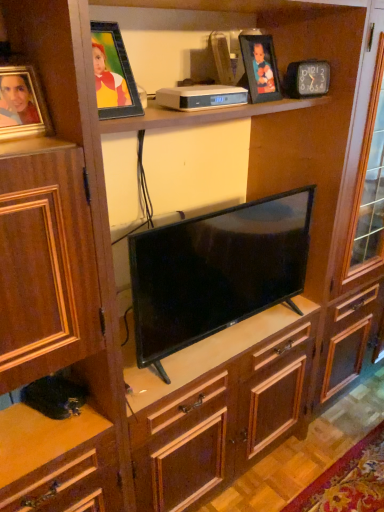
You are a GUI agent. You are given a task and a screenshot of the screen. Output one action in this format:
    pyautogui.click(x=<x>, y=<y>)
    Task: Click on the matte gold picture frame at left, acting as the 2th picture frame starting from the top
    The image size is (384, 512).
    Given the screenshot: What is the action you would take?
    pyautogui.click(x=22, y=104)

Image resolution: width=384 pixels, height=512 pixels. In order to click on matte black picture frame at upper center, the second picture frame viewed from the front in this screenshot , I will do `click(260, 68)`.

This screenshot has width=384, height=512. I want to click on black glossy tv at center, so click(216, 271).

Considering the sizes of objects matte gold picture frame at left, which is counted as the second picture frame, starting from the right, and black glossy tv at center in the image provided, who is taller, matte gold picture frame at left, which is counted as the second picture frame, starting from the right, or black glossy tv at center?

With more height is black glossy tv at center.

Can you confirm if matte gold picture frame at left, which ranks as the first picture frame in left-to-right order, is smaller than black glossy tv at center?

Yes.

Is matte black picture frame at upper center, the second picture frame viewed from the front, turned away from matte gold picture frame at left, positioned as the second picture frame in back-to-front order?

No, matte black picture frame at upper center, the second picture frame viewed from the front, is not facing the opposite direction of matte gold picture frame at left, positioned as the second picture frame in back-to-front order.

Is matte black picture frame at upper center, which is the first picture frame in right-to-left order, closer to camera compared to matte gold picture frame at left, the first picture frame from the bottom?

No, it is not.

Does matte black picture frame at upper center, which is the first picture frame in right-to-left order, contain matte gold picture frame at left, which is counted as the second picture frame, starting from the right?

That's incorrect, matte gold picture frame at left, which is counted as the second picture frame, starting from the right, is not inside matte black picture frame at upper center, which is the first picture frame in right-to-left order.

Does point (272, 92) appear closer or farther from the camera than point (40, 119)?

Point (272, 92) is positioned farther from the camera compared to point (40, 119).

Which is less distant, (185,247) or (242,49)?

Point (185,247) is closer to the camera than point (242,49).

Is black glossy tv at center taller or shorter than matte black picture frame at upper center, positioned as the second picture frame in left-to-right order?

Considering their sizes, black glossy tv at center has more height than matte black picture frame at upper center, positioned as the second picture frame in left-to-right order.

Is the surface of black glossy tv at center in direct contact with matte black picture frame at upper center, arranged as the first picture frame when viewed from the top?

black glossy tv at center is not next to matte black picture frame at upper center, arranged as the first picture frame when viewed from the top, and they're not touching.

Between black glossy tv at center and matte black picture frame at upper center, which is the first picture frame in right-to-left order, which one has smaller size?

matte black picture frame at upper center, which is the first picture frame in right-to-left order, is smaller.

At what (x,y) coordinates should I click in order to perform the action: click on television on the right side of matte gold picture frame at left, positioned as the second picture frame in back-to-front order. Please return your answer as a coordinate pair (x, y). Looking at the image, I should click on (216, 271).

From a real-world perspective, which object stands above the other?

matte gold picture frame at left, which is counted as the second picture frame, starting from the right.

Who is smaller, black glossy tv at center or matte gold picture frame at left, positioned as the second picture frame in back-to-front order?

matte gold picture frame at left, positioned as the second picture frame in back-to-front order.

Looking at this image, which is more to the left, black glossy tv at center or matte gold picture frame at left, which is counted as the first picture frame, starting from the front?

From the viewer's perspective, matte gold picture frame at left, which is counted as the first picture frame, starting from the front, appears more on the left side.

Consider the image. Which of these two, matte gold picture frame at left, which is counted as the first picture frame, starting from the front, or matte black picture frame at upper center, arranged as the first picture frame when viewed from the top, stands taller?

matte black picture frame at upper center, arranged as the first picture frame when viewed from the top.

At what (x,y) coordinates should I click in order to perform the action: click on picture frame that appears above the matte gold picture frame at left, which is counted as the second picture frame, starting from the right (from a real-world perspective). Please return your answer as a coordinate pair (x, y). Looking at the image, I should click on (260, 68).

Based on the photo, is matte gold picture frame at left, which ranks as the first picture frame in left-to-right order, closer to the viewer compared to matte black picture frame at upper center, which is the first picture frame in right-to-left order?

Yes.

Is matte black picture frame at upper center, marked as the 2th picture frame in a bottom-to-top arrangement, closer to the viewer compared to black glossy tv at center?

No, the depth of matte black picture frame at upper center, marked as the 2th picture frame in a bottom-to-top arrangement, is greater than that of black glossy tv at center.

Can you confirm if matte black picture frame at upper center, positioned as the second picture frame in left-to-right order, is smaller than black glossy tv at center?

Yes, matte black picture frame at upper center, positioned as the second picture frame in left-to-right order, is smaller than black glossy tv at center.

Does matte black picture frame at upper center, the second picture frame viewed from the front, appear on the left side of black glossy tv at center?

Incorrect, matte black picture frame at upper center, the second picture frame viewed from the front, is not on the left side of black glossy tv at center.

In the image, there is a matte gold picture frame at left, which ranks as the first picture frame in left-to-right order. Identify the location of television below it (from a real-world perspective). This screenshot has height=512, width=384. (216, 271).

Locate an element on the screen. picture frame that appears below the matte black picture frame at upper center, which is the first picture frame in right-to-left order (from the image's perspective) is located at coordinates [x=22, y=104].

Considering their positions, is matte black picture frame at upper center, arranged as the first picture frame when viewed from the top, positioned further to black glossy tv at center than matte gold picture frame at left, acting as the 2th picture frame starting from the top?

matte gold picture frame at left, acting as the 2th picture frame starting from the top, is further to black glossy tv at center.

Which object lies further to the anchor point matte black picture frame at upper center, which ranks as the first picture frame in back-to-front order, black glossy tv at center or matte gold picture frame at left, which is counted as the first picture frame, starting from the front?

matte gold picture frame at left, which is counted as the first picture frame, starting from the front, lies further to matte black picture frame at upper center, which ranks as the first picture frame in back-to-front order, than the other object.

From the image, which object appears to be nearer to matte black picture frame at upper center, the second picture frame viewed from the front, matte gold picture frame at left, which is counted as the second picture frame, starting from the right, or black glossy tv at center?

black glossy tv at center is positioned closer to the anchor matte black picture frame at upper center, the second picture frame viewed from the front.

In the scene shown: Considering their positions, is black glossy tv at center positioned further to matte gold picture frame at left, positioned as the second picture frame in back-to-front order, than matte black picture frame at upper center, marked as the 2th picture frame in a bottom-to-top arrangement?

Among the two, matte black picture frame at upper center, marked as the 2th picture frame in a bottom-to-top arrangement, is located further to matte gold picture frame at left, positioned as the second picture frame in back-to-front order.

Looking at the image, which one is located further to black glossy tv at center, matte gold picture frame at left, which is counted as the first picture frame, starting from the front, or matte black picture frame at upper center, marked as the 2th picture frame in a bottom-to-top arrangement?

Based on the image, matte gold picture frame at left, which is counted as the first picture frame, starting from the front, appears to be further to black glossy tv at center.

Looking at the image, which one is located closer to matte gold picture frame at left, which is counted as the first picture frame, starting from the front, matte black picture frame at upper center, which ranks as the first picture frame in back-to-front order, or black glossy tv at center?

The object closer to matte gold picture frame at left, which is counted as the first picture frame, starting from the front, is black glossy tv at center.

You are a GUI agent. You are given a task and a screenshot of the screen. Output one action in this format:
    pyautogui.click(x=<x>, y=<y>)
    Task: Click on the television located between matte gold picture frame at left, the first picture frame from the bottom, and matte black picture frame at upper center, the second picture frame viewed from the front, in the left-right direction
    The image size is (384, 512).
    Given the screenshot: What is the action you would take?
    pyautogui.click(x=216, y=271)